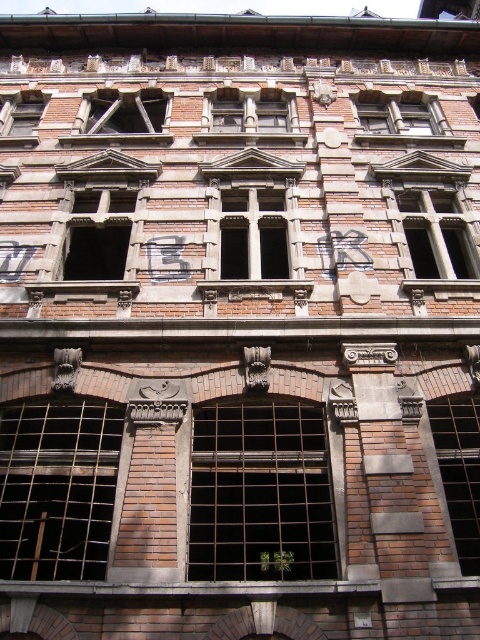
Question: Which object is positioned closest to the brick window at upper left?

Choices:
 (A) brick textured window at center
 (B) matte brick window at upper center
 (C) rusty metal bars at lower left
 (D) brown brick window at upper center

Answer: (A)

Question: Which point is closer to the camera?

Choices:
 (A) (295, 456)
 (B) (294, 115)

Answer: (A)

Question: Does rusty metal bars at lower left have a lesser width compared to matte brick window at upper center?

Choices:
 (A) no
 (B) yes

Answer: (A)

Question: Is rusty metal bars at lower left in front of matte brick window at upper center?

Choices:
 (A) yes
 (B) no

Answer: (A)

Question: Does brown brick window at upper center have a smaller size compared to brick window at upper left?

Choices:
 (A) yes
 (B) no

Answer: (A)

Question: Which object is the closest to the brick textured window at center?

Choices:
 (A) metallic glass window at upper center
 (B) brick window at upper left
 (C) rusty metal bars at lower left

Answer: (A)